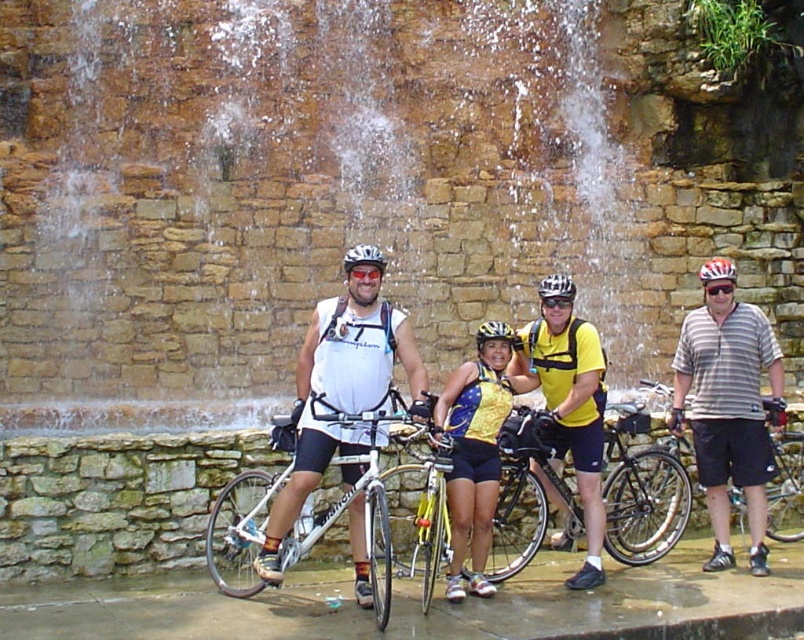
You are a photographer setting up a tripod to take a photo of the cyclists. The tripod has a narrow slot that can only fit one item at a time. If you want to place either the shiny metallic bicycle at center or the shiny silver helmet at center into the slot, which one can fit through the slot?

The shiny metallic bicycle at center is thinner than the shiny silver helmet at center, so the shiny metallic bicycle at center can fit through the narrow slot.

You are a photographer trying to capture a clear shot of the shiny metallic bicycle at center and the matte white helmet at center. Since the waterfall is spraying water upwards, which object might be more affected by the mist and require adjustment in your camera settings?

The shiny metallic bicycle at center is in front of the matte white helmet at center, so it will be more exposed to the mist from the waterfall and may require adjustments in camera settings to account for the moisture and reflective surface.